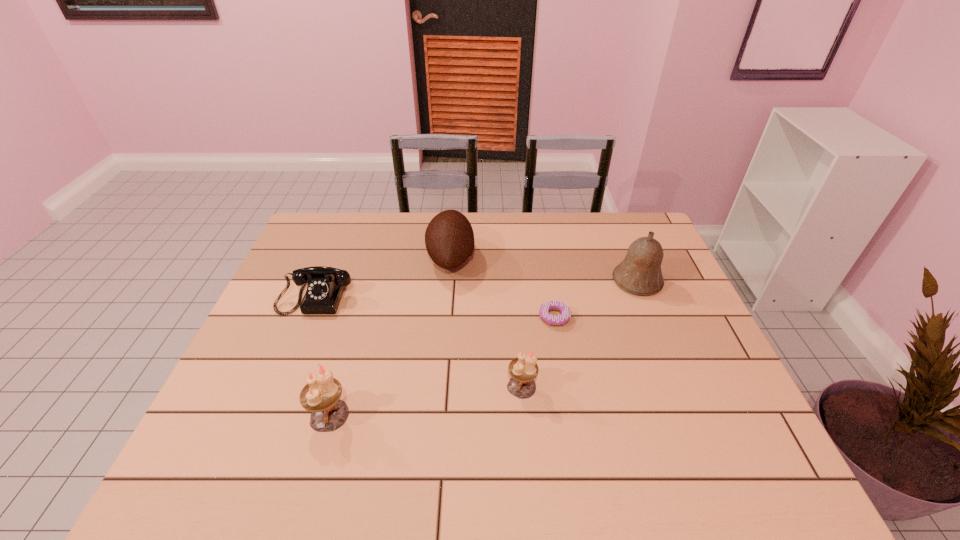
Please point out where to position a new candle holder on the right to maintain spacing. Please provide its 2D coordinates. Your answer should be formatted as a tuple, i.e. [(x, y)], where the tuple contains the x and y coordinates of a point satisfying the conditions above.

[(694, 361)]